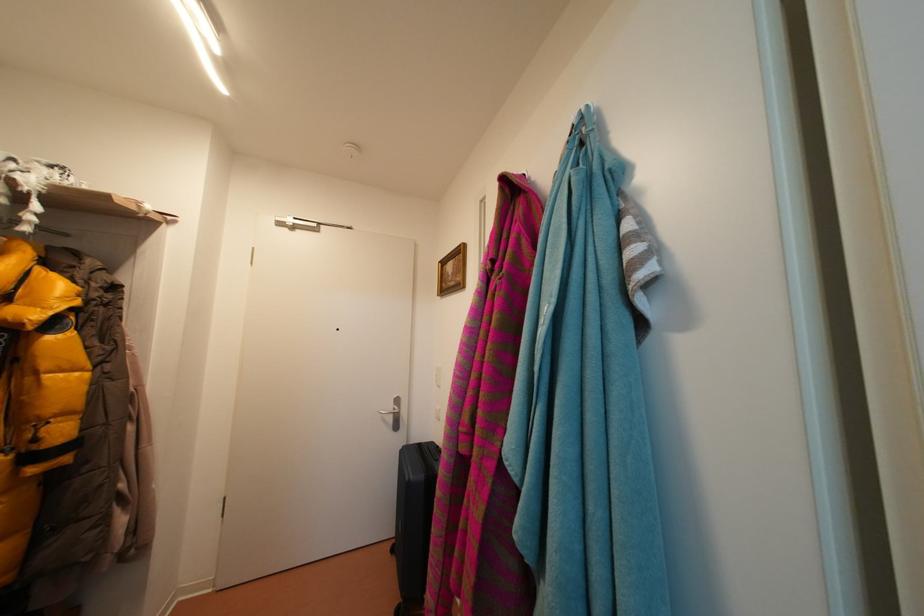
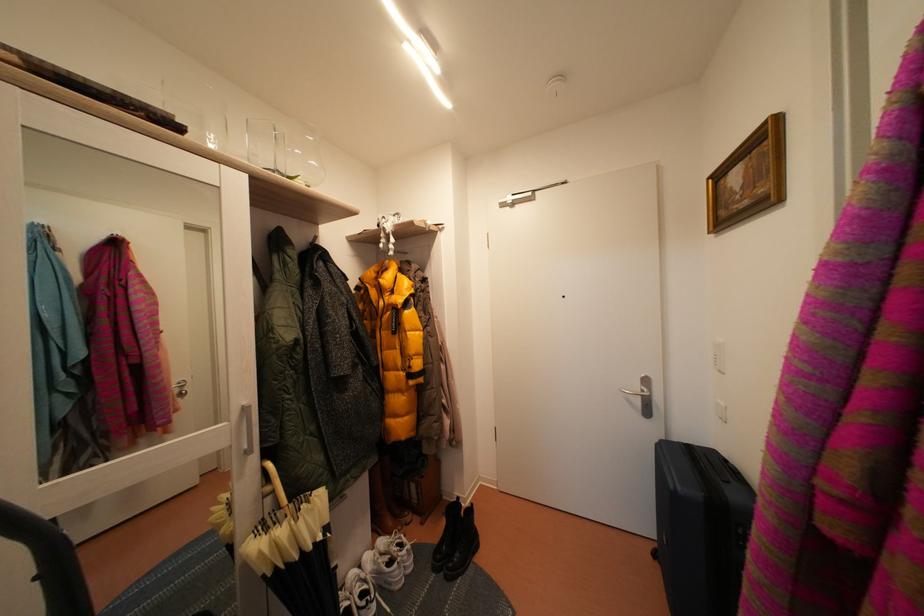
Question: The camera is either moving clockwise (left) or counter-clockwise (right) around the object. The first image is from the beginning of the video and the second image is from the end. Is the camera moving left or right when shooting the video?

Choices:
 (A) Left
 (B) Right

Answer: (B)